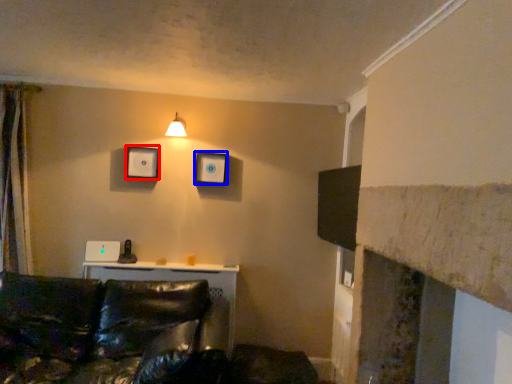
Question: Among these objects, which one is farthest to the camera, picture frame (highlighted by a red box) or picture frame (highlighted by a blue box)?

Choices:
 (A) picture frame
 (B) picture frame

Answer: (B)